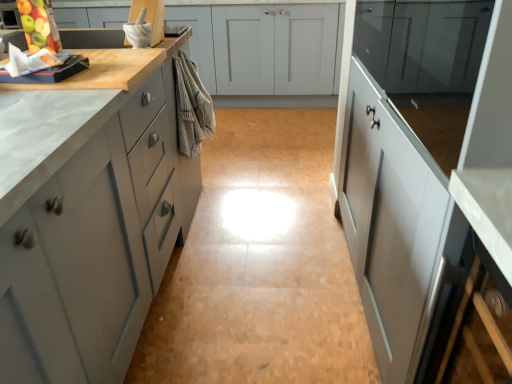
Question: Considering the relative positions of green matte apple at upper left and glossy glass cabinet at upper right, the third cabinetry from the front, in the image provided, is green matte apple at upper left to the left of glossy glass cabinet at upper right, the third cabinetry from the front, from the viewer's perspective?

Choices:
 (A) no
 (B) yes

Answer: (B)

Question: Is green matte apple at upper left positioned behind glossy glass cabinet at upper right, the third cabinetry from the front?

Choices:
 (A) yes
 (B) no

Answer: (A)

Question: Is green matte apple at upper left in front of glossy glass cabinet at upper right, the third cabinetry from the front?

Choices:
 (A) no
 (B) yes

Answer: (A)

Question: Is glossy glass cabinet at upper right, the second cabinetry from the back, a part of green matte apple at upper left?

Choices:
 (A) no
 (B) yes

Answer: (A)

Question: Can you confirm if green matte apple at upper left is taller than glossy glass cabinet at upper right, the third cabinetry from the front?

Choices:
 (A) yes
 (B) no

Answer: (B)

Question: From a real-world perspective, is green matte apple at upper left beneath glossy glass cabinet at upper right, the second cabinetry from the back?

Choices:
 (A) no
 (B) yes

Answer: (A)

Question: Is matte gray cabinets at center, marked as the 1th cabinetry in a back-to-front arrangement, a part of green matte apple at upper left?

Choices:
 (A) no
 (B) yes

Answer: (A)

Question: Can we say green matte apple at upper left lies outside matte gray cabinets at center, marked as the 1th cabinetry in a back-to-front arrangement?

Choices:
 (A) no
 (B) yes

Answer: (B)

Question: Is green matte apple at upper left closer to camera compared to matte gray cabinets at center, marked as the 1th cabinetry in a back-to-front arrangement?

Choices:
 (A) yes
 (B) no

Answer: (A)

Question: Is green matte apple at upper left wider than matte gray cabinets at center, placed as the 4th cabinetry when sorted from front to back?

Choices:
 (A) no
 (B) yes

Answer: (A)

Question: Is green matte apple at upper left to the left of matte gray cabinets at center, placed as the 4th cabinetry when sorted from front to back, from the viewer's perspective?

Choices:
 (A) no
 (B) yes

Answer: (B)

Question: Does green matte apple at upper left have a larger size compared to matte gray cabinets at center, placed as the 4th cabinetry when sorted from front to back?

Choices:
 (A) yes
 (B) no

Answer: (B)

Question: Is matte gray cabinets at center, marked as the 1th cabinetry in a back-to-front arrangement, at the left side of matte gray cabinets at left, which is the 4th cabinetry in back-to-front order?

Choices:
 (A) yes
 (B) no

Answer: (B)